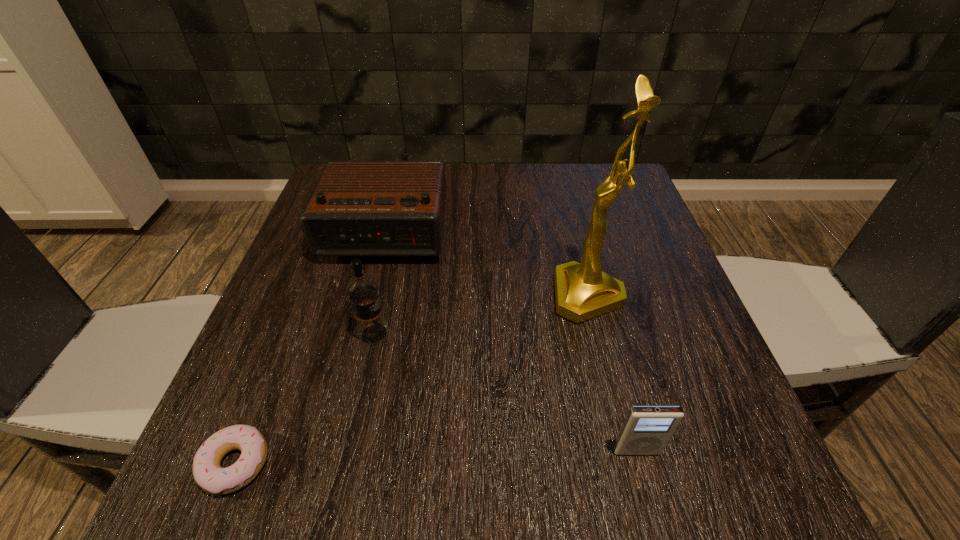
Image resolution: width=960 pixels, height=540 pixels. In order to click on object that is the third closest one to the award in this screenshot , I will do `click(363, 293)`.

This screenshot has width=960, height=540. In order to click on free spot that satisfies the following two spatial constraints: 1. on the front-facing side of the award; 2. on the front side of the doughnut in this screenshot , I will do `click(629, 464)`.